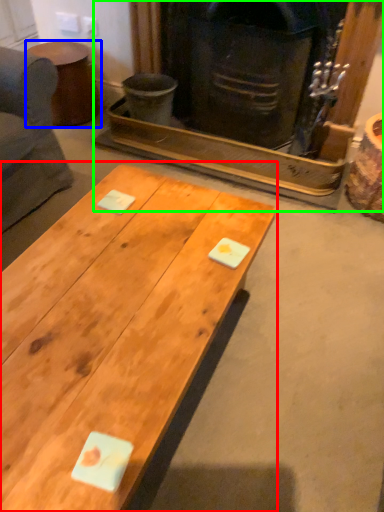
Question: Based on their relative distances, which object is nearer to coffee table (highlighted by a red box)? Choose from side table (highlighted by a blue box) and fireplace (highlighted by a green box).

Choices:
 (A) side table
 (B) fireplace

Answer: (B)